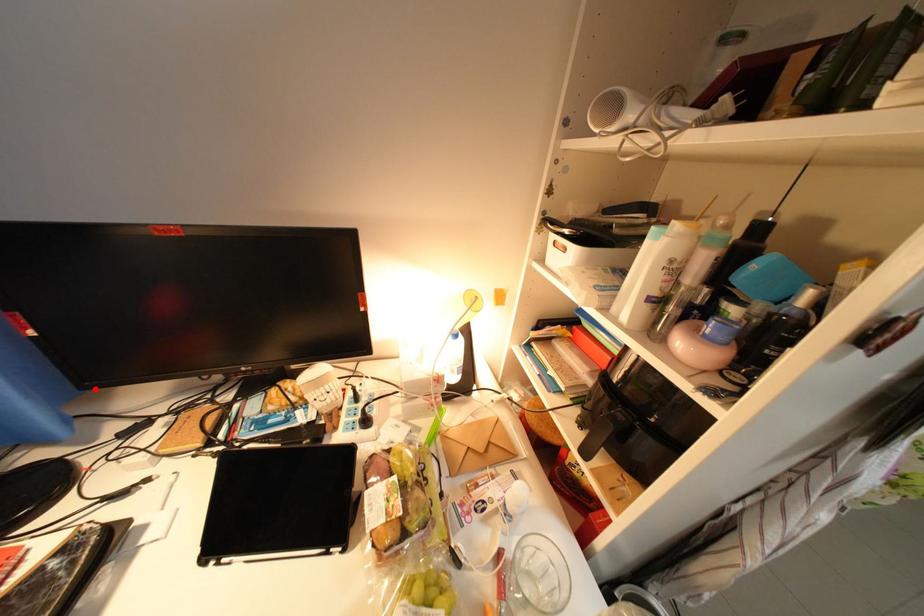
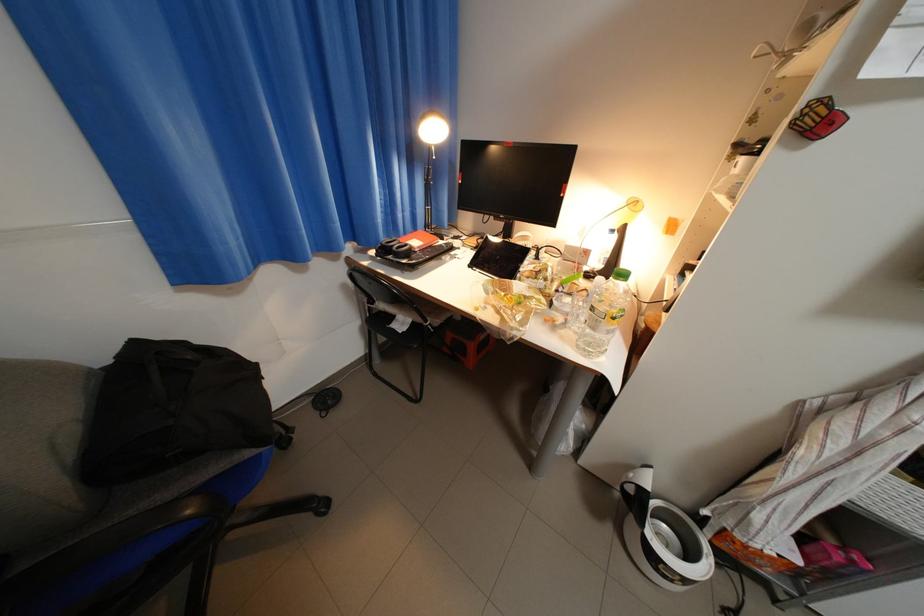
Find the pixel in the second image that matches the highlighted location in the first image.

(469, 209)